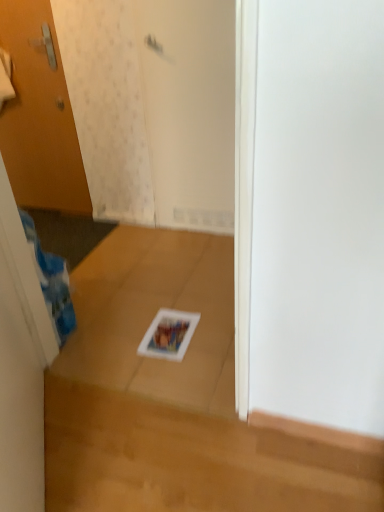
At what (x,y) coordinates should I click in order to perform the action: click on free space in front of white matte screen door at upper center. Please return your answer as a coordinate pair (x, y). The height and width of the screenshot is (512, 384). Looking at the image, I should click on (192, 259).